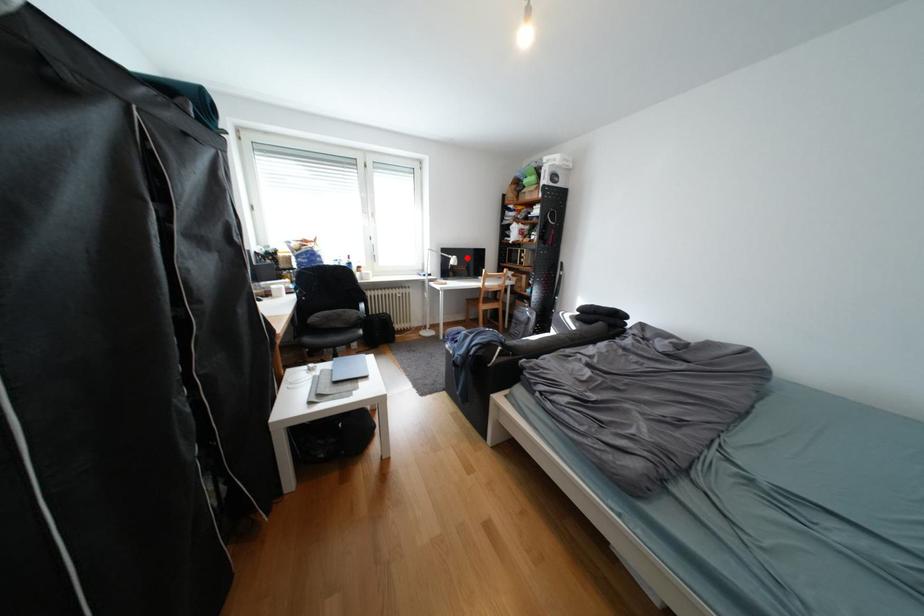
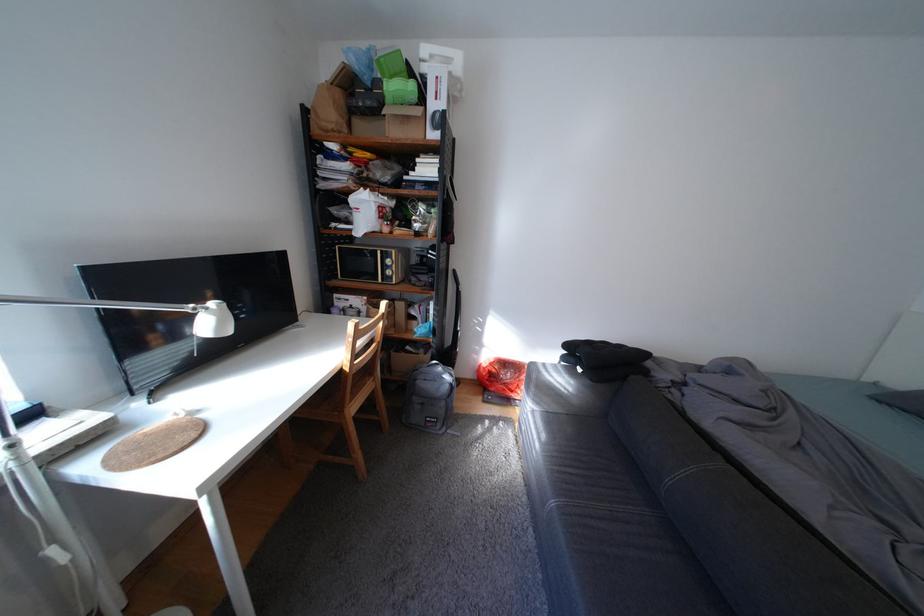
Question: I am providing you with two images of the same scene from different viewpoints. A red point is marked on the first image. Is the red point's position out of view in image 2?

Choices:
 (A) Yes
 (B) No

Answer: (B)